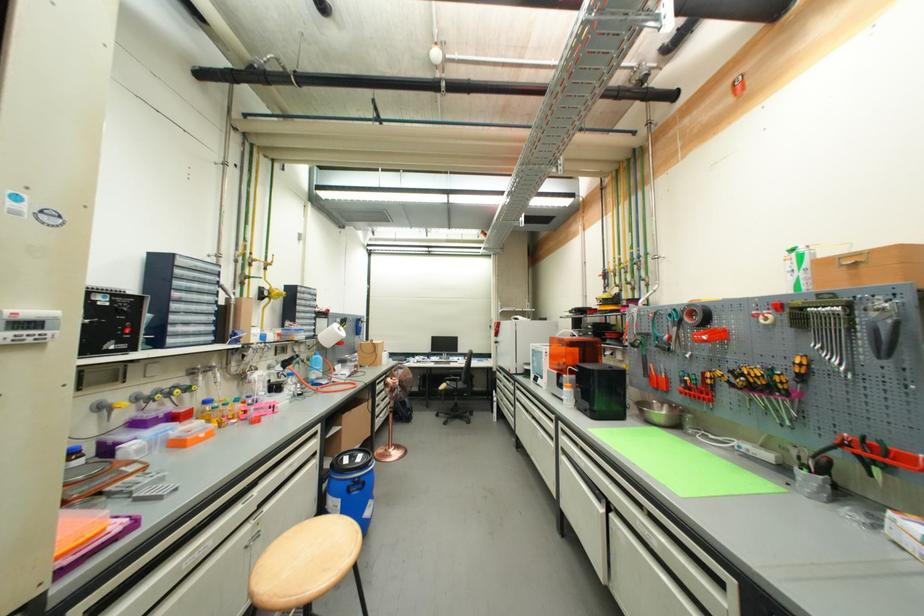
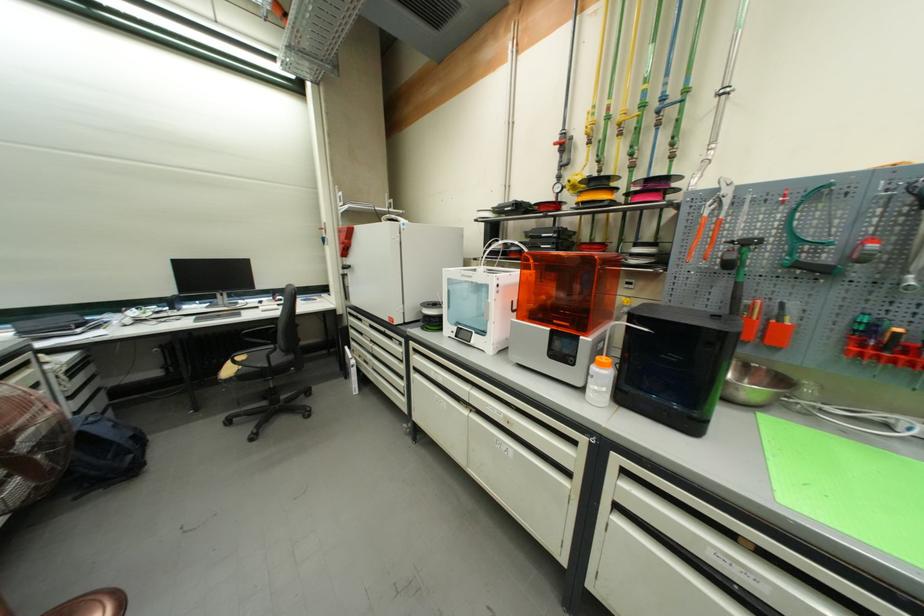
In the second image, find the point that corresponds to the point at 662,346 in the first image.

(803, 262)